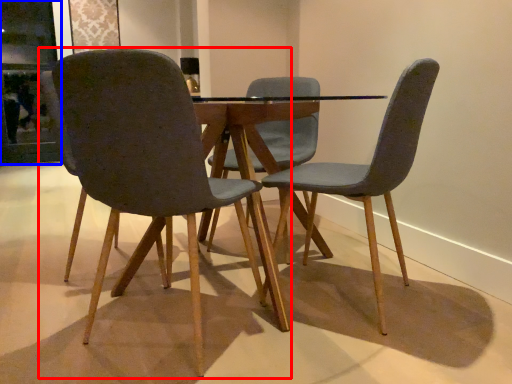
Question: Among these objects, which one is farthest to the camera, chair (highlighted by a red box) or glass door (highlighted by a blue box)?

Choices:
 (A) chair
 (B) glass door

Answer: (B)